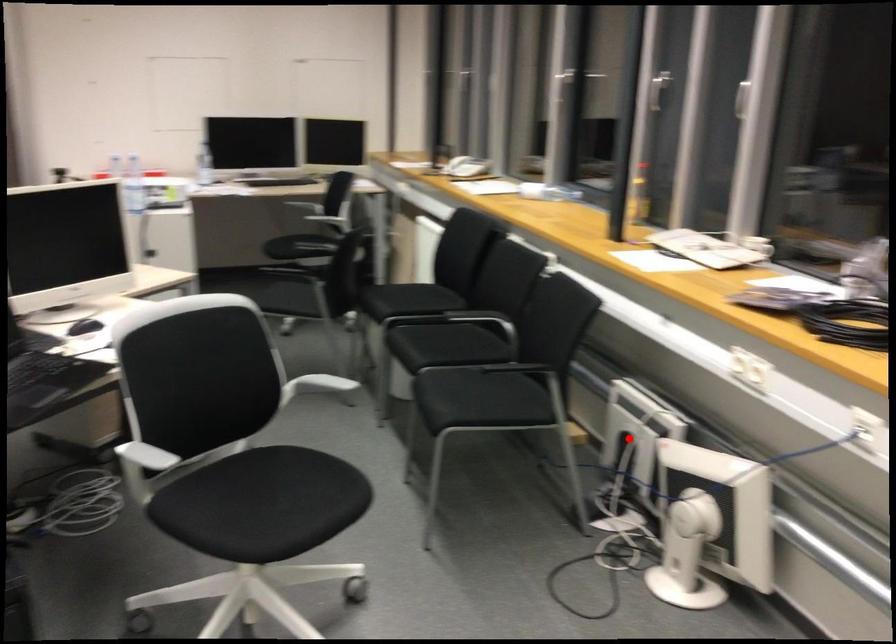
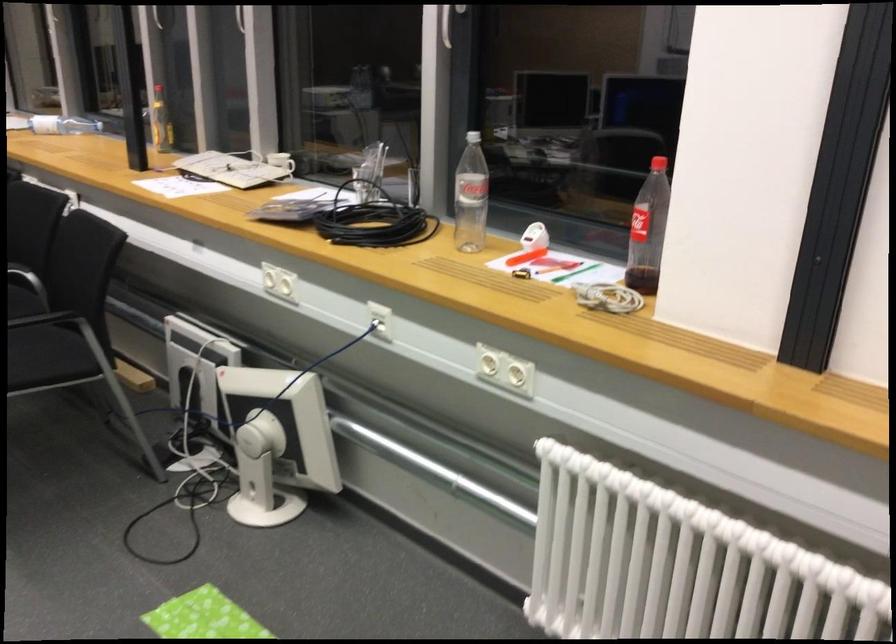
In the second image, find the point that corresponds to the highlighted location in the first image.

(196, 375)